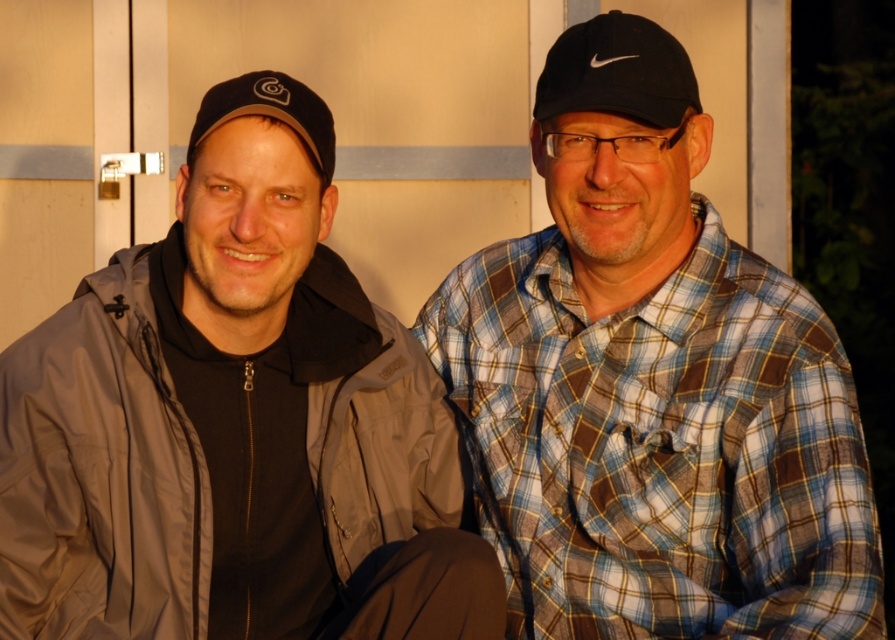
Question: Does blue plaid shirt at center appear over black matte baseball cap at left?

Choices:
 (A) no
 (B) yes

Answer: (A)

Question: Is blue plaid shirt at center in front of black matte baseball cap at left?

Choices:
 (A) yes
 (B) no

Answer: (A)

Question: Based on their relative distances, which object is farther from the black nike cap at center?

Choices:
 (A) matte black jacket at left
 (B) blue plaid shirt at center

Answer: (A)

Question: In this image, where is matte black jacket at left located relative to black matte baseball cap at left?

Choices:
 (A) below
 (B) above

Answer: (A)

Question: Which is nearer to the black matte baseball cap at left?

Choices:
 (A) blue plaid shirt at center
 (B) black nike cap at center

Answer: (B)

Question: Which point is farther to the camera?

Choices:
 (A) black matte baseball cap at left
 (B) black nike cap at center
 (C) matte black jacket at left

Answer: (A)